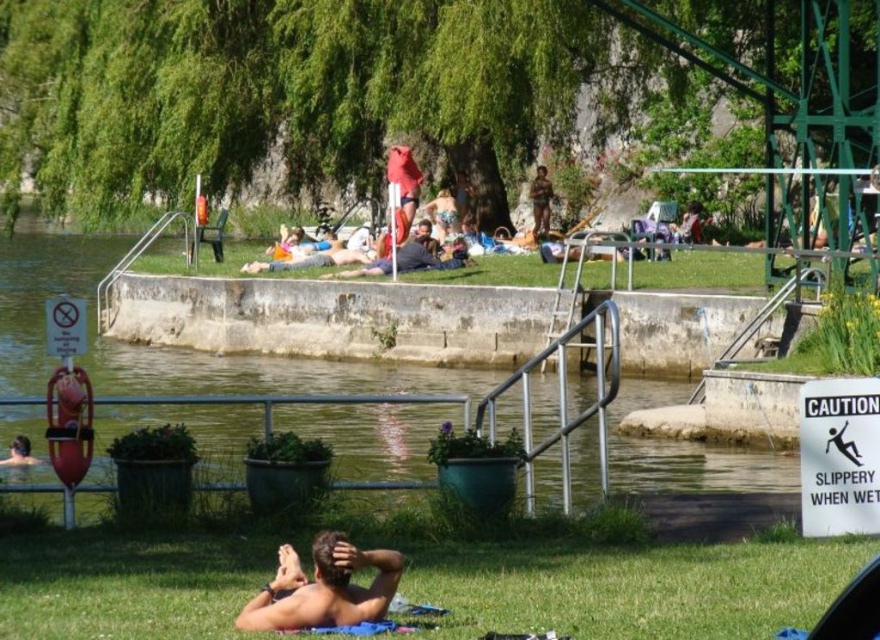
Does green concrete river at center have a larger size compared to dark gray fabric shirt at center?

Indeed, green concrete river at center has a larger size compared to dark gray fabric shirt at center.

Is point (174, 381) more distant than point (427, 244)?

No, (174, 381) is in front of (427, 244).

Where is `green concrete river at center`? The image size is (880, 640). green concrete river at center is located at coordinates (327, 317).

Between point (633, 280) and point (543, 202), which one is positioned in front?

Positioned in front is point (633, 280).

Is green grass at center closer to the viewer compared to brown textured shorts at center?

That is True.

Locate an element on the screen. The image size is (880, 640). green grass at center is located at coordinates (701, 272).

Can you confirm if green grass at lower center is bigger than smooth skin man at lower center?

Actually, green grass at lower center might be smaller than smooth skin man at lower center.

Can you confirm if green grass at lower center is wider than smooth skin man at lower center?

Yes.

Between point (151, 556) and point (330, 609), which one is positioned behind?

Point (151, 556)

You are a GUI agent. You are given a task and a screenshot of the screen. Output one action in this format:
    pyautogui.click(x=<x>, y=<y>)
    Task: Click on the green grass at lower center
    This screenshot has width=880, height=640.
    Given the screenshot: What is the action you would take?
    pyautogui.click(x=627, y=586)